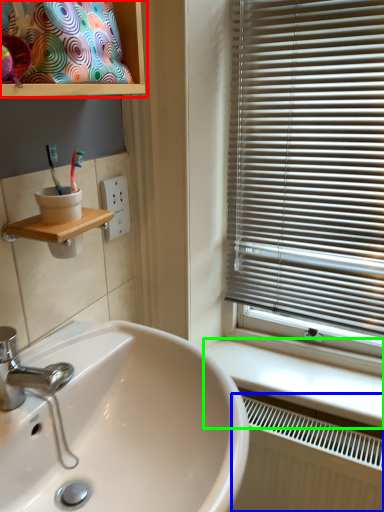
Question: Based on their relative distances, which object is farther from cabinet (highlighted by a red box)? Choose from radiator (highlighted by a blue box) and counter top (highlighted by a green box).

Choices:
 (A) radiator
 (B) counter top

Answer: (A)